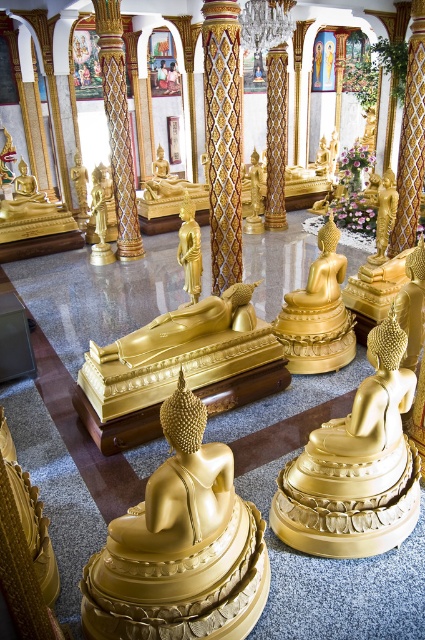
Question: Does gold shiny statue at center appear on the right side of gold polished statue at center?

Choices:
 (A) yes
 (B) no

Answer: (A)

Question: Where is gold shiny statue at center located in relation to gold polished statue at center in the image?

Choices:
 (A) above
 (B) below

Answer: (B)

Question: Considering the real-world distances, which object is farthest from the gold shiny statue at center?

Choices:
 (A) gold textured pillar at center
 (B) gold polished statue at center

Answer: (B)

Question: Which of these objects is positioned farthest from the gold textured pillar at center?

Choices:
 (A) gold polished statue at center
 (B) gold shiny statue at center

Answer: (B)

Question: Which point is farther to the camera?

Choices:
 (A) (82, 196)
 (B) (102, 4)
 (C) (226, 557)

Answer: (A)

Question: Is gold textured pillar at center further to camera compared to gold polished statue at center?

Choices:
 (A) no
 (B) yes

Answer: (A)